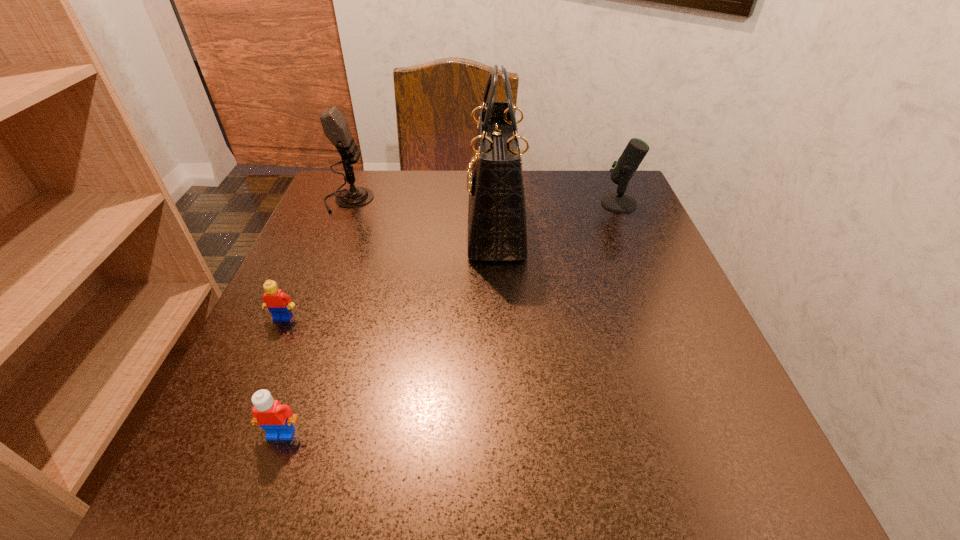
Where is `object that stands as the fourth closest to the second nearest object`? object that stands as the fourth closest to the second nearest object is located at coordinates (623, 169).

This screenshot has width=960, height=540. In order to click on vacant space that satisfies the following two spatial constraints: 1. on the front-facing side of the taller microphone; 2. on the face of the fourth farthest object in this screenshot , I will do `click(300, 318)`.

This screenshot has width=960, height=540. I want to click on vacant space that satisfies the following two spatial constraints: 1. at the front of the tallest object with visible charms; 2. on the face of the farther Lego, so click(x=500, y=318).

This screenshot has width=960, height=540. Find the location of `vacant region that satisfies the following two spatial constraints: 1. on the front-facing side of the left microphone; 2. on the face of the left Lego`. vacant region that satisfies the following two spatial constraints: 1. on the front-facing side of the left microphone; 2. on the face of the left Lego is located at coordinates (300, 318).